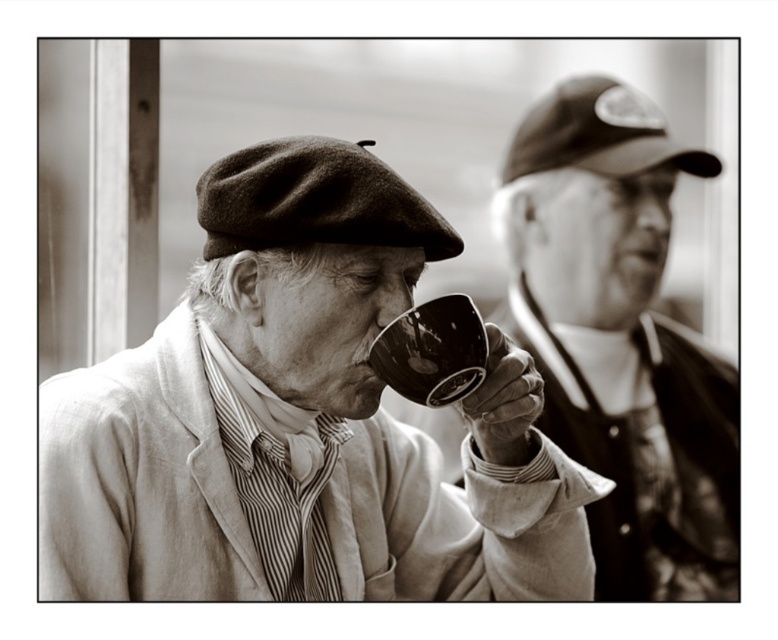
You are standing in front of the photograph and want to place a small note on the exact spot where the matte black cup at center is located. According to the coordinates provided, where should you place the note?

The matte black cup at center is located at point 0.658 on the horizontal axis and 0.387 on the vertical axis, so you should place the note at those coordinates.

You are a photographer analyzing the composition of this black and white photo. You notice the matte black cup at right and the glossy ceramic mug at upper center. Which object is positioned higher in the frame?

The glossy ceramic mug at upper center is positioned higher in the frame than the matte black cup at right.